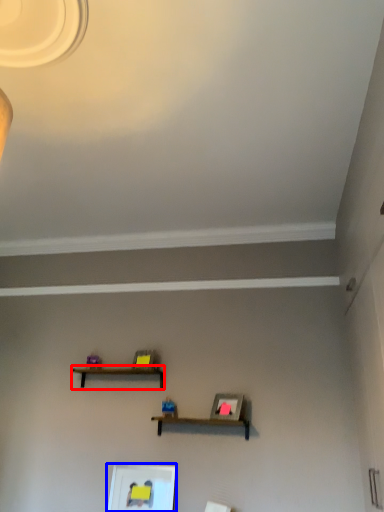
Question: Among these objects, which one is farthest to the camera, shelf (highlighted by a red box) or picture frame (highlighted by a blue box)?

Choices:
 (A) shelf
 (B) picture frame

Answer: (A)